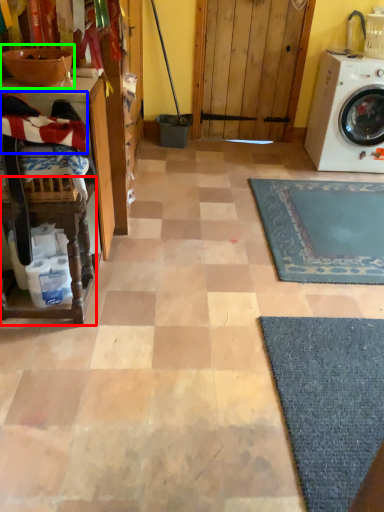
Question: Considering the real-world distances, which object is farthest from table (highlighted by a red box)? laundry (highlighted by a blue box) or sink (highlighted by a green box)?

Choices:
 (A) laundry
 (B) sink

Answer: (B)